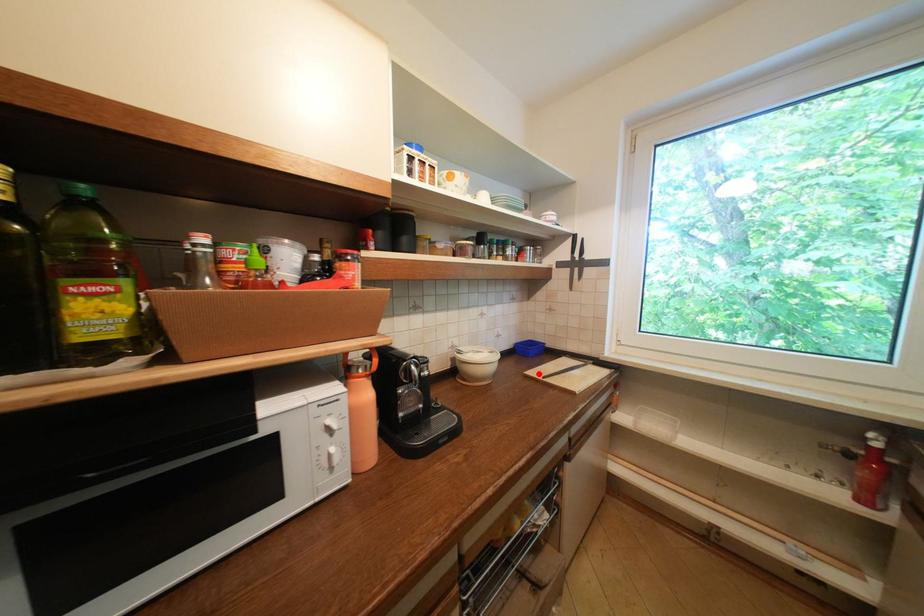
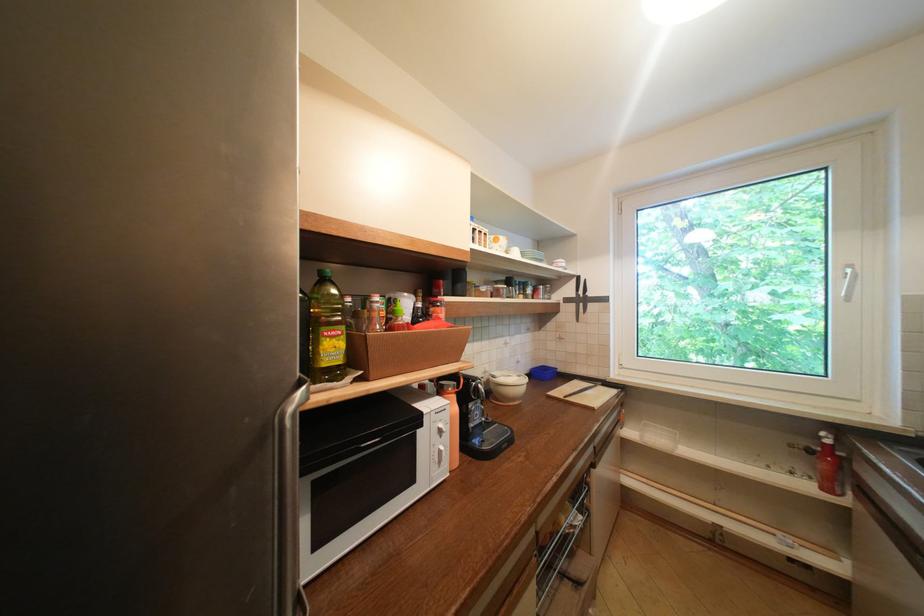
Find the pixel in the second image that matches the highlighted location in the first image.

(561, 394)